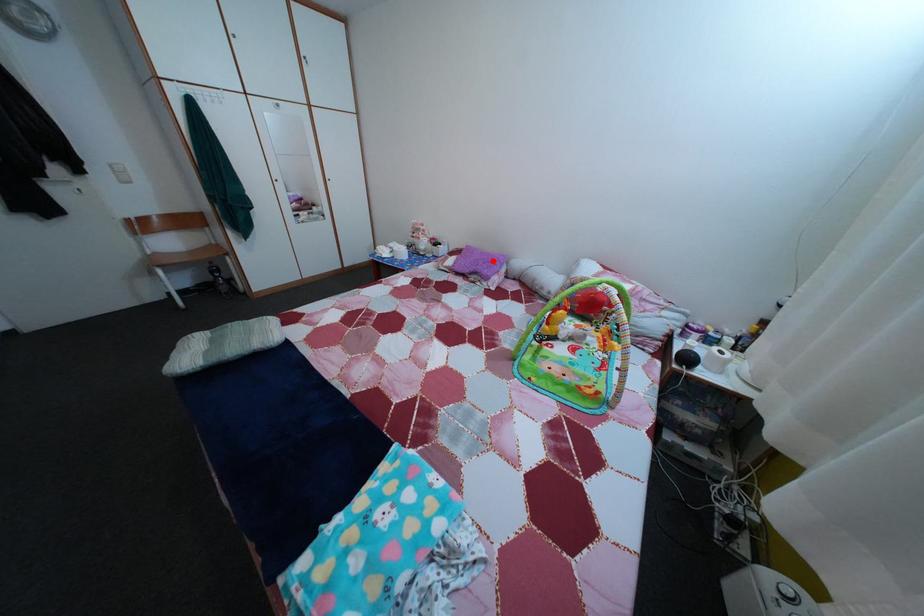
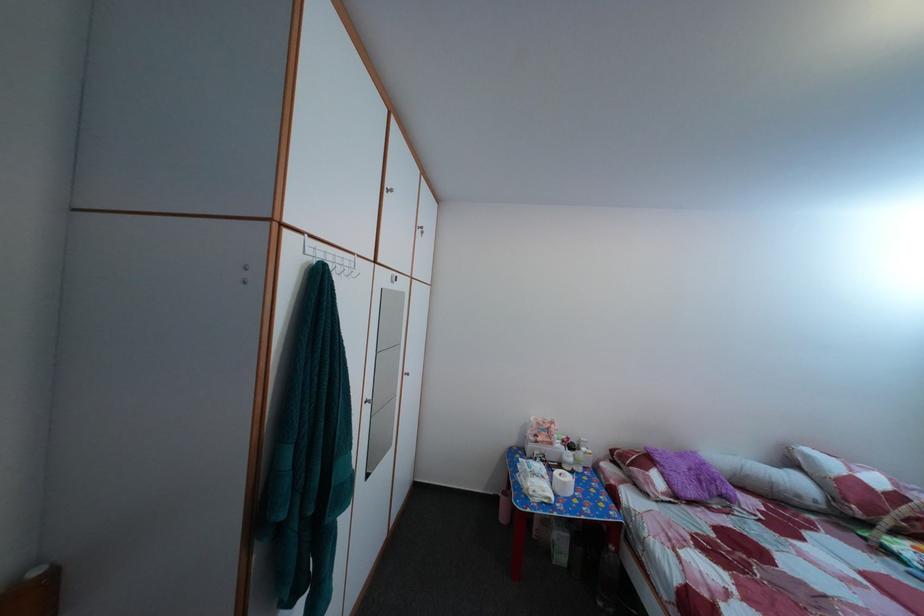
Question: A red point is marked in image1. In image2, is the corresponding 3D point closer to the camera or farther? Reply with the corresponding letter.

Choices:
 (A) The corresponding 3D point is closer.
 (B) The corresponding 3D point is farther.

Answer: (B)